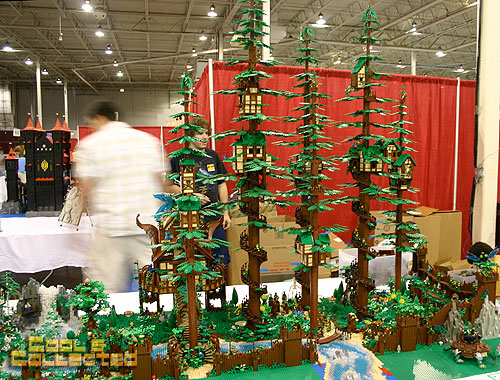
At what (x,y) coordinates should I click in order to perform the action: click on wall of space where image is located. Please return your answer as a coordinate pair (x, y). Image resolution: width=500 pixels, height=380 pixels. Looking at the image, I should click on (143, 106).